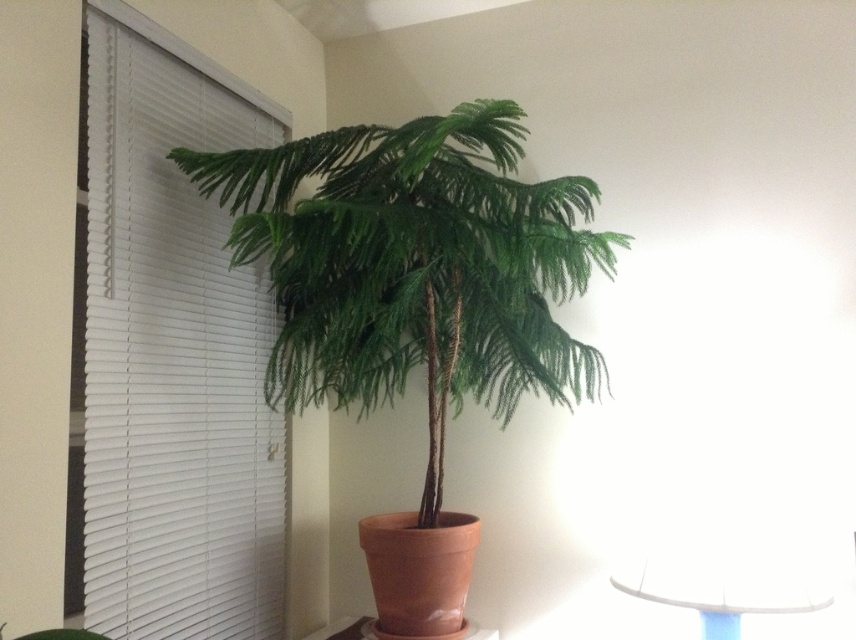
Question: Is white blinds at left thinner than green matte/painted palm tree at center?

Choices:
 (A) no
 (B) yes

Answer: (B)

Question: Which is nearer to the green matte/painted palm tree at center?

Choices:
 (A) white blinds at left
 (B) white glossy table at lower right

Answer: (A)

Question: Estimate the real-world distances between objects in this image. Which object is farther from the white glossy table at lower right?

Choices:
 (A) green matte/painted palm tree at center
 (B) white blinds at left

Answer: (B)

Question: Among these points, which one is farthest from the camera?

Choices:
 (A) (107, 552)
 (B) (749, 568)

Answer: (B)

Question: In this image, where is white blinds at left located relative to white glossy table at lower right?

Choices:
 (A) right
 (B) left

Answer: (B)

Question: Is green matte/painted palm tree at center further to the viewer compared to white glossy table at lower right?

Choices:
 (A) yes
 (B) no

Answer: (B)